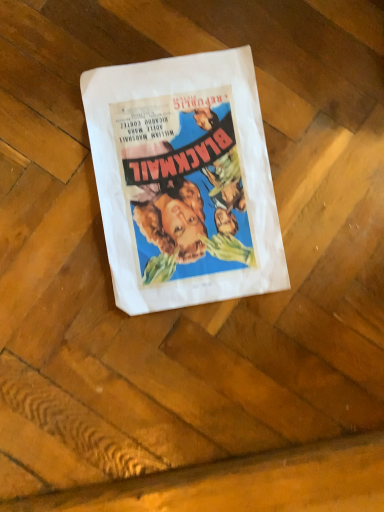
The width and height of the screenshot is (384, 512). What do you see at coordinates (184, 181) in the screenshot? I see `white paper at center` at bounding box center [184, 181].

In order to face white paper at center, should I rotate leftwards or rightwards?

To face it directly, rotate right by 0.532 degrees.

The height and width of the screenshot is (512, 384). In order to click on white paper at center in this screenshot , I will do `click(184, 181)`.

You are a GUI agent. You are given a task and a screenshot of the screen. Output one action in this format:
    pyautogui.click(x=<x>, y=<y>)
    Task: Click on the white paper at center
    Image resolution: width=384 pixels, height=512 pixels.
    Given the screenshot: What is the action you would take?
    pyautogui.click(x=184, y=181)